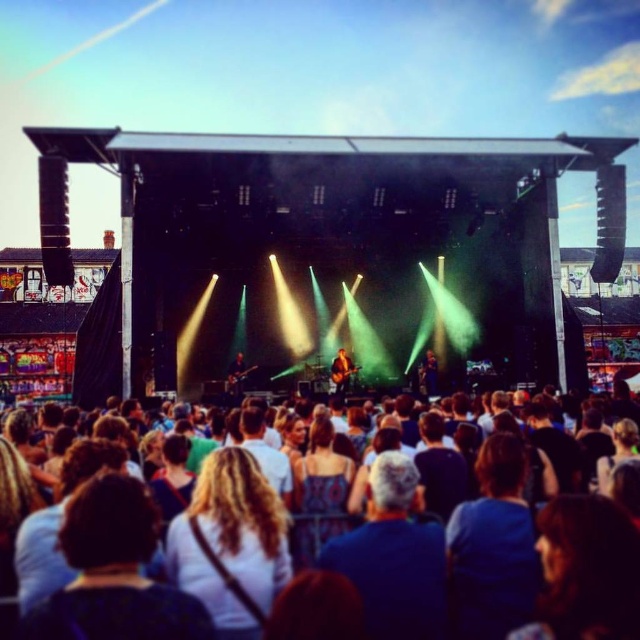
Is point (324, 595) farther from camera compared to point (243, 365)?

No, (324, 595) is in front of (243, 365).

Measure the distance between brown fabric crowd at lower center and camera.

brown fabric crowd at lower center is 80.99 meters away from camera.

I want to click on brown fabric crowd at lower center, so pos(342,561).

Is point (342, 611) behind point (420, 365)?

No, it is not.

Between brown fabric crowd at lower center and dark brown leather jacket at center, which one appears on the left side from the viewer's perspective?

brown fabric crowd at lower center

You are a GUI agent. You are given a task and a screenshot of the screen. Output one action in this format:
    pyautogui.click(x=<x>, y=<y>)
    Task: Click on the brown fabric crowd at lower center
    The width and height of the screenshot is (640, 640).
    Given the screenshot: What is the action you would take?
    pyautogui.click(x=342, y=561)

Can you confirm if dark brown leather jacket at center is positioned to the left of shiny brown guitar at center?

No, dark brown leather jacket at center is not to the left of shiny brown guitar at center.

Is point (429, 358) more distant than point (342, 352)?

Yes, it is.

You are a GUI agent. You are given a task and a screenshot of the screen. Output one action in this format:
    pyautogui.click(x=<x>, y=<y>)
    Task: Click on the dark brown leather jacket at center
    
    Given the screenshot: What is the action you would take?
    pyautogui.click(x=428, y=374)